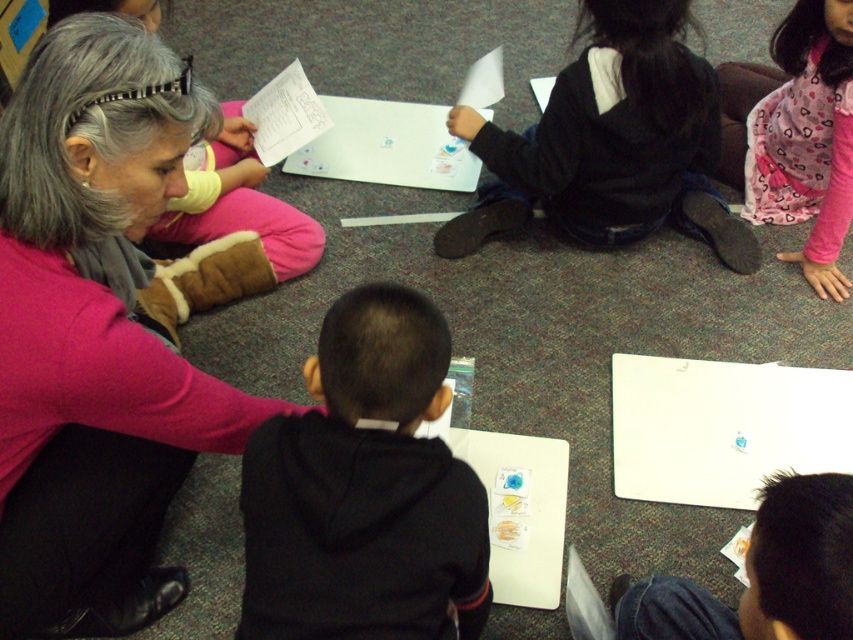
Can you confirm if black fleece hoodie at center is shorter than black hoodie at upper center?

Yes, black fleece hoodie at center is shorter than black hoodie at upper center.

Looking at this image, is black fleece hoodie at center thinner than black hoodie at upper center?

Correct, black fleece hoodie at center's width is less than black hoodie at upper center's.

Looking at this image, measure the distance between black fleece hoodie at center and camera.

black fleece hoodie at center is 1.02 meters from camera.

Locate an element on the screen. This screenshot has height=640, width=853. black fleece hoodie at center is located at coordinates (364, 490).

Can you confirm if pink fleece sweater at upper left is positioned above black hoodie at upper center?

No, pink fleece sweater at upper left is not above black hoodie at upper center.

Looking at this image, does pink fleece sweater at upper left lie behind black hoodie at upper center?

No, it is in front of black hoodie at upper center.

Is point (157, 586) positioned in front of point (453, 116)?

Yes, point (157, 586) is in front of point (453, 116).

Identify the location of pink fleece sweater at upper left. (96, 333).

Is the position of black fleece hoodie at center more distant than that of denim jeans at lower right?

Yes, black fleece hoodie at center is behind denim jeans at lower right.

Is black fleece hoodie at center above denim jeans at lower right?

Yes.

Who is more distant from viewer, (339, 483) or (833, 538)?

The point (339, 483) is more distant.

Find the location of a particular element. The image size is (853, 640). black fleece hoodie at center is located at coordinates (364, 490).